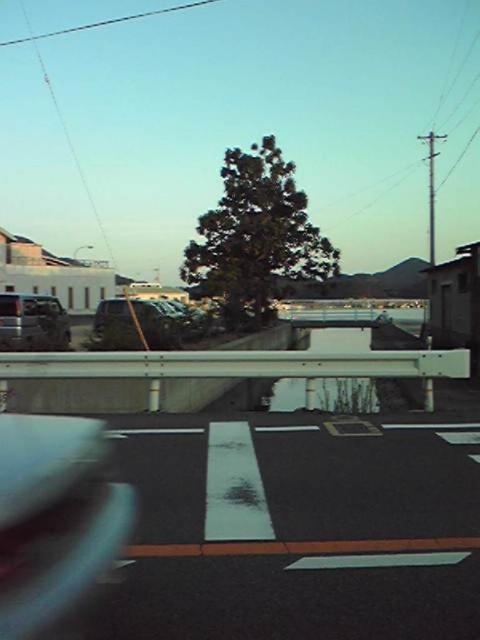
Question: Which of the following is the closest to the observer?

Choices:
 (A) (16, 298)
 (B) (108, 326)

Answer: (B)

Question: Is the position of metallic silver car at center less distant than that of transparent glass car window at lower left?

Choices:
 (A) no
 (B) yes

Answer: (B)

Question: Which of the following is the closest to the observer?

Choices:
 (A) metallic silver suv at left
 (B) transparent glass car window at lower left
 (C) metallic silver car at center

Answer: (C)

Question: Which point appears farthest from the camera in this image?

Choices:
 (A) (11, 296)
 (B) (108, 308)

Answer: (B)

Question: From the image, what is the correct spatial relationship of metallic silver car at center in relation to metallic silver suv at left?

Choices:
 (A) above
 (B) below

Answer: (B)

Question: Observing the image, what is the correct spatial positioning of metallic silver car at center in reference to transparent glass car window at lower left?

Choices:
 (A) left
 (B) right

Answer: (B)